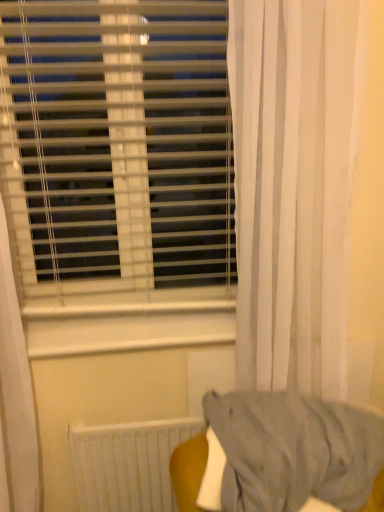
Question: From the image's perspective, is white matte radiator at lower center under white sheer curtain at right?

Choices:
 (A) no
 (B) yes

Answer: (B)

Question: Is white matte radiator at lower center smaller than white sheer curtain at right?

Choices:
 (A) yes
 (B) no

Answer: (A)

Question: From a real-world perspective, is white matte radiator at lower center beneath white sheer curtain at right?

Choices:
 (A) no
 (B) yes

Answer: (B)

Question: Is white matte radiator at lower center further to the viewer compared to white sheer curtain at right?

Choices:
 (A) yes
 (B) no

Answer: (A)

Question: Does white matte radiator at lower center have a greater height compared to white sheer curtain at right?

Choices:
 (A) yes
 (B) no

Answer: (B)

Question: Considering the relative sizes of white matte radiator at lower center and white sheer curtain at right in the image provided, is white matte radiator at lower center thinner than white sheer curtain at right?

Choices:
 (A) yes
 (B) no

Answer: (A)

Question: Is white matte radiator at lower center outside white plastic blinds at upper left?

Choices:
 (A) yes
 (B) no

Answer: (A)

Question: Is white matte radiator at lower center smaller than white plastic blinds at upper left?

Choices:
 (A) yes
 (B) no

Answer: (A)

Question: Could white plastic blinds at upper left be considered to be inside white matte radiator at lower center?

Choices:
 (A) yes
 (B) no

Answer: (B)

Question: Is white matte radiator at lower center closer to camera compared to white plastic blinds at upper left?

Choices:
 (A) yes
 (B) no

Answer: (B)

Question: Is white matte radiator at lower center at the right side of white plastic blinds at upper left?

Choices:
 (A) yes
 (B) no

Answer: (A)

Question: Is white matte radiator at lower center at the left side of white plastic blinds at upper left?

Choices:
 (A) yes
 (B) no

Answer: (B)

Question: Is white sheer curtain at right oriented towards white plastic blinds at upper left?

Choices:
 (A) yes
 (B) no

Answer: (B)